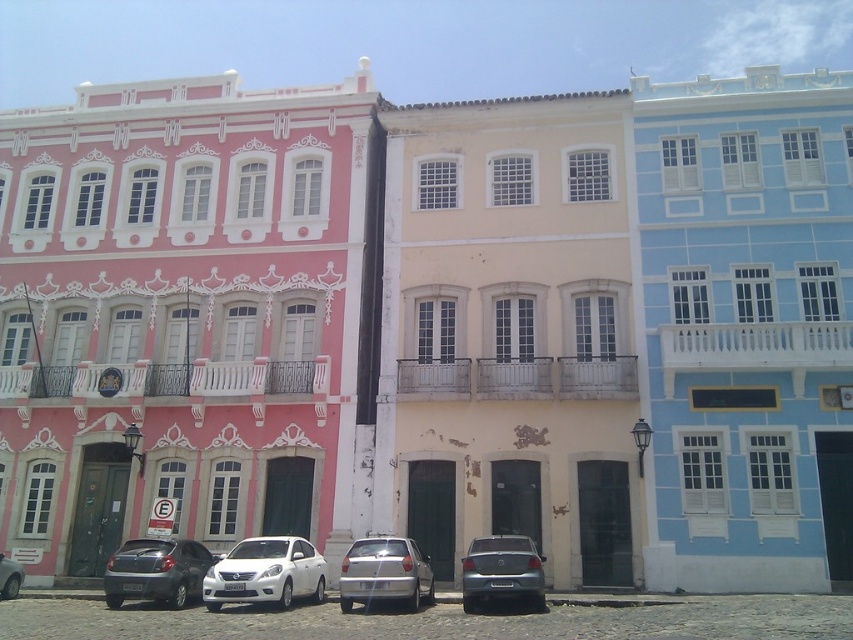
You are a delivery driver approaching the historic district and see the image. You need to park your metallic gray hatchback at lower left and silver metallic hatchback at center. Which parking spot is closer to the road?

The metallic gray hatchback at lower left is located below the silver metallic hatchback at center, so it is closer to the road.

You are standing at the point closest to the blue building on the right. From your position, which of the two points, point (170, 540) or point (405, 589), is closer to you?

Point (405, 589) is closer to you because it is in front of point (170, 540).